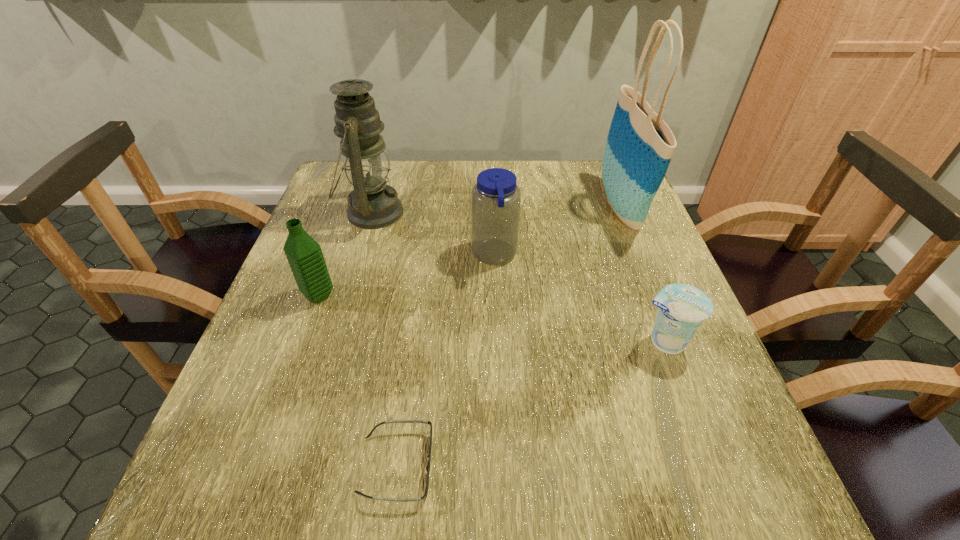
Identify the location of free space located 0.160m on the front of the tallest object. (654, 292).

At what (x,y) coordinates should I click in order to perform the action: click on vacant space situated 0.170m on the front of the fifth shortest object. Please return your answer as a coordinate pair (x, y). The height and width of the screenshot is (540, 960). Looking at the image, I should click on (349, 288).

This screenshot has width=960, height=540. Find the location of `free space located 0.160m with a carrying loop on the side of the right water bottle`. free space located 0.160m with a carrying loop on the side of the right water bottle is located at coordinates (405, 256).

Locate an element on the screen. Image resolution: width=960 pixels, height=540 pixels. free location located with a carrying loop on the side of the right water bottle is located at coordinates (338, 256).

You are a GUI agent. You are given a task and a screenshot of the screen. Output one action in this format:
    pyautogui.click(x=<x>, y=<y>)
    Task: Click on the vacant point located with a carrying loop on the side of the right water bottle
    The width and height of the screenshot is (960, 540).
    Given the screenshot: What is the action you would take?
    pyautogui.click(x=430, y=256)

Where is `vacant region located on the front of the left water bottle`? vacant region located on the front of the left water bottle is located at coordinates (303, 338).

Locate an element on the screen. This screenshot has width=960, height=540. vacant region located on the back of the second shortest object is located at coordinates (646, 295).

I want to click on free region located 0.050m on the front-facing side of the sunglasses, so click(464, 465).

Find the location of a particular element. The width and height of the screenshot is (960, 540). tote bag located in the far edge section of the desktop is located at coordinates (639, 147).

The image size is (960, 540). What are the coordinates of `oil lamp that is positioned at the far edge` in the screenshot? It's located at (372, 204).